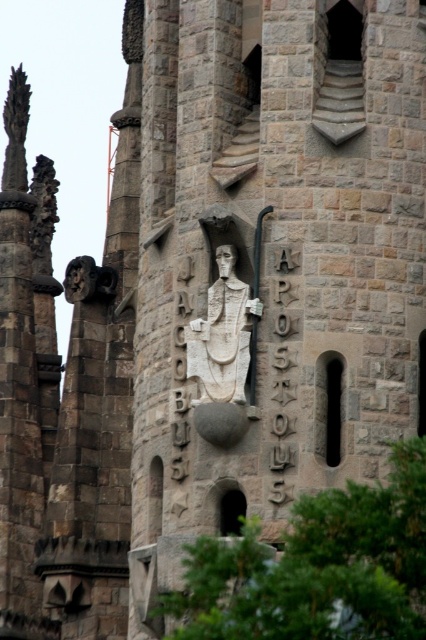
The image size is (426, 640). What do you see at coordinates (221, 340) in the screenshot?
I see `white stone statue at center` at bounding box center [221, 340].

Does point (222, 284) come farther from viewer compared to point (229, 252)?

Yes, it is behind point (229, 252).

Does point (244, 307) lie behind point (229, 250)?

That is False.

This screenshot has height=640, width=426. I want to click on white stone statue at center, so click(x=221, y=340).

Does matte stone face at upper left have a greater width compared to white stone face at center?

Yes.

Does matte stone face at upper left have a larger size compared to white stone face at center?

Correct, matte stone face at upper left is larger in size than white stone face at center.

Find the location of a particular element. The height and width of the screenshot is (640, 426). matte stone face at upper left is located at coordinates (80, 280).

Can you confirm if white stone statue at center is thinner than matte stone face at upper left?

Correct, white stone statue at center's width is less than matte stone face at upper left's.

This screenshot has width=426, height=640. What do you see at coordinates (221, 340) in the screenshot?
I see `white stone statue at center` at bounding box center [221, 340].

What do you see at coordinates (221, 340) in the screenshot?
I see `white stone statue at center` at bounding box center [221, 340].

Locate an element on the screen. The width and height of the screenshot is (426, 640). white stone statue at center is located at coordinates (221, 340).